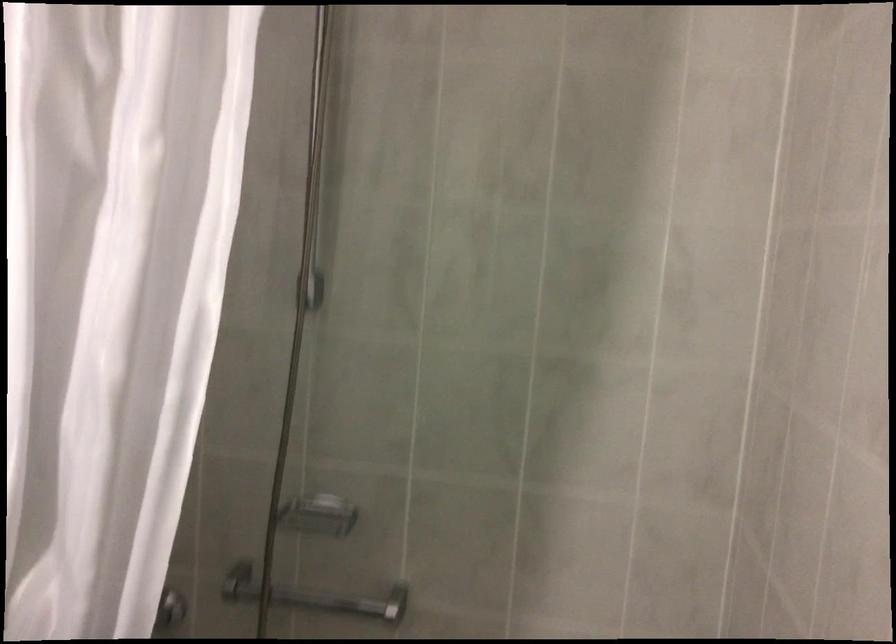
What are the coordinates of `faucet handle` in the screenshot? It's located at (314, 597).